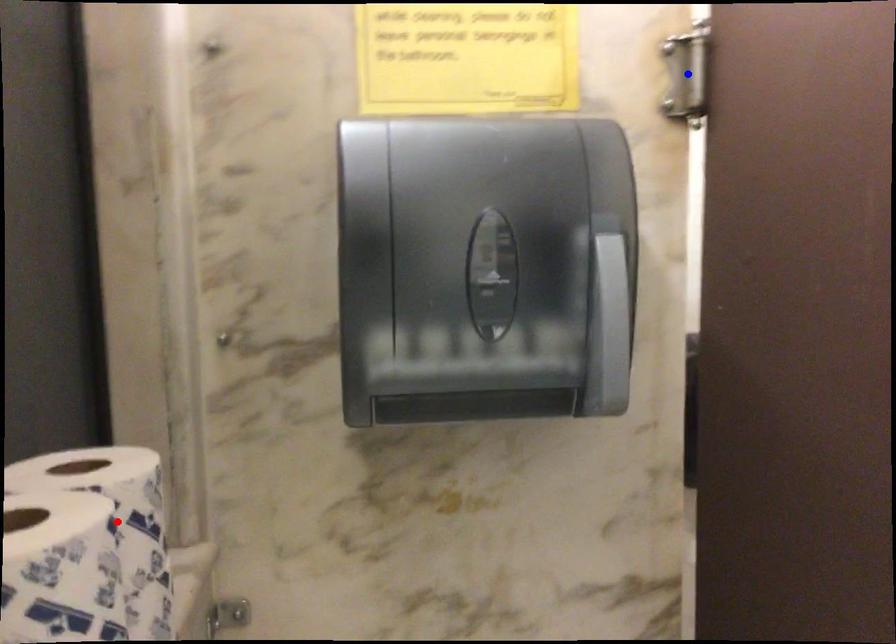
Question: Which of the two points in the image is closer to the camera?

Choices:
 (A) Blue point is closer.
 (B) Red point is closer.

Answer: (B)